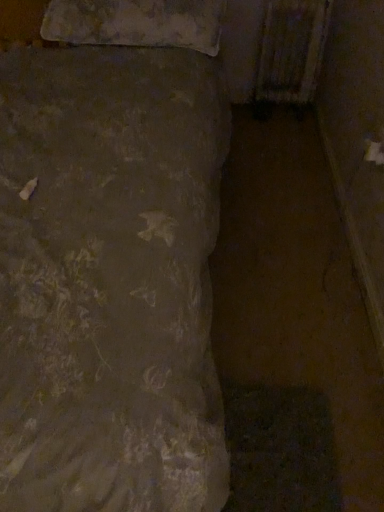
In order to face rusty metal radiator at upper right, should I rotate leftwards or rightwards?

Rotate right and turn 12.970 degrees.

I want to click on rusty metal radiator at upper right, so click(x=292, y=50).

Describe the element at coordinates (292, 50) in the screenshot. I see `rusty metal radiator at upper right` at that location.

What do you see at coordinates (135, 23) in the screenshot?
I see `textured beige pillow at upper left` at bounding box center [135, 23].

What is the approximate height of textured beige pillow at upper left?

22.99 centimeters.

In order to face textured beige pillow at upper left, should I rotate leftwards or rightwards?

Rotate your view left by about 7.062°.

Measure the distance between textured beige pillow at upper left and camera.

textured beige pillow at upper left and camera are 5.36 feet apart from each other.

I want to click on textured beige pillow at upper left, so click(x=135, y=23).

Identify the location of rusty metal radiator at upper right. Image resolution: width=384 pixels, height=512 pixels. (292, 50).

Is rusty metal radiator at upper right at the left side of textured beige pillow at upper left?

No, rusty metal radiator at upper right is not to the left of textured beige pillow at upper left.

Is rusty metal radiator at upper right in front of or behind textured beige pillow at upper left in the image?

In the image, rusty metal radiator at upper right appears behind textured beige pillow at upper left.

Does point (284, 68) come behind point (130, 19)?

Yes, point (284, 68) is behind point (130, 19).

From the image's perspective, is rusty metal radiator at upper right positioned above or below textured beige pillow at upper left?

Clearly, from the image's perspective, rusty metal radiator at upper right is above textured beige pillow at upper left.

From a real-world perspective, is rusty metal radiator at upper right beneath textured beige pillow at upper left?

Yes, from a real-world perspective, rusty metal radiator at upper right is beneath textured beige pillow at upper left.

Considering the relative sizes of rusty metal radiator at upper right and textured beige pillow at upper left in the image provided, is rusty metal radiator at upper right wider than textured beige pillow at upper left?

No.

Considering the sizes of rusty metal radiator at upper right and textured beige pillow at upper left in the image, is rusty metal radiator at upper right taller or shorter than textured beige pillow at upper left?

Clearly, rusty metal radiator at upper right is taller compared to textured beige pillow at upper left.

Can you confirm if rusty metal radiator at upper right is smaller than textured beige pillow at upper left?

Yes.

Is rusty metal radiator at upper right positioned beyond the bounds of textured beige pillow at upper left?

Yes, rusty metal radiator at upper right is located beyond the bounds of textured beige pillow at upper left.

Is there a large distance between rusty metal radiator at upper right and textured beige pillow at upper left?

No, there isn't a large distance between rusty metal radiator at upper right and textured beige pillow at upper left.

Could you tell me if rusty metal radiator at upper right is facing textured beige pillow at upper left?

No, rusty metal radiator at upper right does not turn towards textured beige pillow at upper left.

Consider the image. How different are the orientations of rusty metal radiator at upper right and textured beige pillow at upper left in degrees?

rusty metal radiator at upper right and textured beige pillow at upper left are facing 0.363 degrees away from each other.

I want to click on pillow below the rusty metal radiator at upper right (from the image's perspective), so click(135, 23).

Between textured beige pillow at upper left and rusty metal radiator at upper right, which one appears on the left side from the viewer's perspective?

textured beige pillow at upper left is more to the left.

Is the depth of textured beige pillow at upper left greater than that of rusty metal radiator at upper right?

No, it is not.

Considering the points (90, 21) and (288, 31), which point is behind, point (90, 21) or point (288, 31)?

The point (288, 31) is more distant.

From the image's perspective, is textured beige pillow at upper left over rusty metal radiator at upper right?

No, from the image's perspective, textured beige pillow at upper left is not on top of rusty metal radiator at upper right.

From a real-world perspective, is textured beige pillow at upper left on rusty metal radiator at upper right?

Yes, from a real-world perspective, textured beige pillow at upper left is above rusty metal radiator at upper right.

Which of these two, textured beige pillow at upper left or rusty metal radiator at upper right, is wider?

With larger width is textured beige pillow at upper left.

Which of these two, textured beige pillow at upper left or rusty metal radiator at upper right, stands taller?

With more height is rusty metal radiator at upper right.

Which of these two, textured beige pillow at upper left or rusty metal radiator at upper right, is bigger?

Bigger between the two is textured beige pillow at upper left.

Is rusty metal radiator at upper right located within textured beige pillow at upper left?

Definitely not — rusty metal radiator at upper right is not inside textured beige pillow at upper left.

Is textured beige pillow at upper left next to rusty metal radiator at upper right and touching it?

No, textured beige pillow at upper left is not beside rusty metal radiator at upper right.

Is textured beige pillow at upper left oriented away from rusty metal radiator at upper right?

No, textured beige pillow at upper left is not facing away from rusty metal radiator at upper right.

Can you tell me how much textured beige pillow at upper left and rusty metal radiator at upper right differ in facing direction?

The facing directions of textured beige pillow at upper left and rusty metal radiator at upper right are 0.363 degrees apart.

In order to click on radiator behind the textured beige pillow at upper left in this screenshot , I will do `click(292, 50)`.

I want to click on radiator above the textured beige pillow at upper left (from the image's perspective), so click(292, 50).

The height and width of the screenshot is (512, 384). I want to click on radiator below the textured beige pillow at upper left (from a real-world perspective), so click(x=292, y=50).